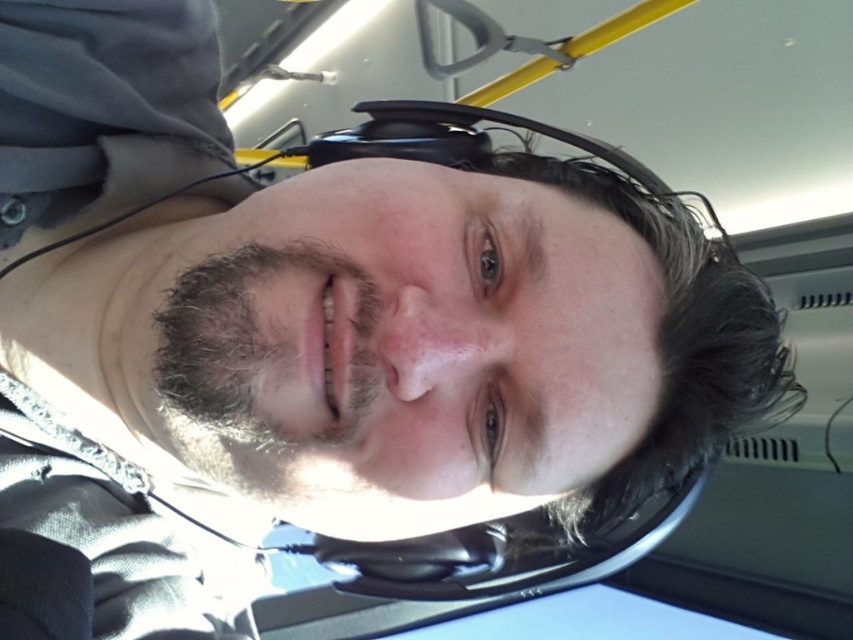
Question: Observing the image, what is the correct spatial positioning of black matte view mirror at center in reference to dark brown curly hair at lower left?

Choices:
 (A) above
 (B) below

Answer: (B)

Question: Which object is farther from the camera taking this photo?

Choices:
 (A) black matte view mirror at center
 (B) dark brown curly hair at lower left

Answer: (A)

Question: Observing the image, what is the correct spatial positioning of black matte view mirror at center in reference to dark brown curly hair at lower left?

Choices:
 (A) above
 (B) below

Answer: (B)

Question: In this image, where is black matte view mirror at center located relative to dark brown curly hair at lower left?

Choices:
 (A) above
 (B) below

Answer: (B)

Question: Which point is farther from the camera taking this photo?

Choices:
 (A) (230, 419)
 (B) (550, 538)

Answer: (B)